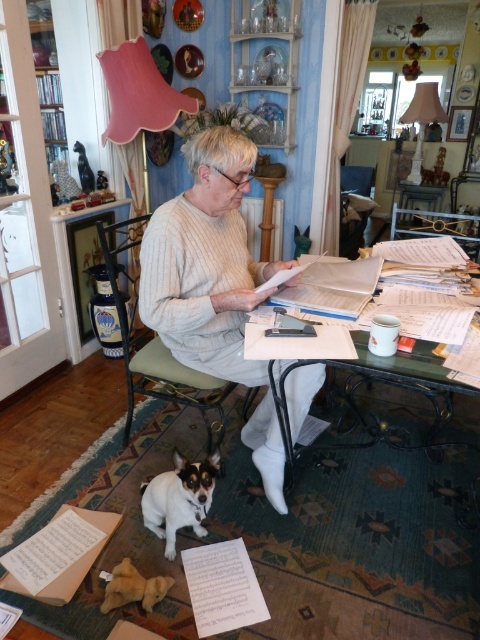
Consider the image. Between brown and white fur dog at lower left and white paper book at center, which one appears on the right side from the viewer's perspective?

From the viewer's perspective, white paper book at center appears more on the right side.

Can you confirm if brown and white fur dog at lower left is wider than white paper book at center?

No, brown and white fur dog at lower left is not wider than white paper book at center.

Who is more forward, [218,464] or [336,275]?

Point [218,464] is in front.

I want to click on brown and white fur dog at lower left, so click(x=179, y=499).

Does translucent glass table at center have a greater height compared to green fabric chair at center?

Indeed, translucent glass table at center has a greater height compared to green fabric chair at center.

Who is shorter, translucent glass table at center or green fabric chair at center?

Standing shorter between the two is green fabric chair at center.

Is point (264, 317) closer to viewer compared to point (128, 392)?

Yes, it is in front of point (128, 392).

At what (x,y) coordinates should I click in order to perform the action: click on translucent glass table at center. Please return your answer as a coordinate pair (x, y). This screenshot has width=480, height=640. Looking at the image, I should click on (312, 308).

Does translucent glass table at center have a greater height compared to brown and white fur dog at lower left?

Yes.

Who is positioned more to the left, translucent glass table at center or brown and white fur dog at lower left?

brown and white fur dog at lower left is more to the left.

Locate an element on the screen. This screenshot has height=640, width=480. translucent glass table at center is located at coordinates (312, 308).